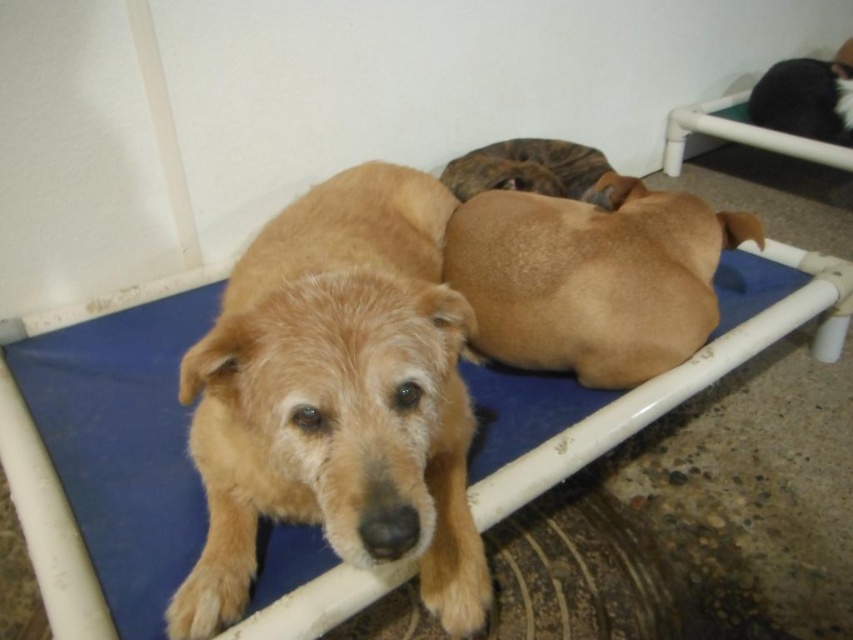
Can you confirm if brown matte dog at center is bigger than brown fur dog at center?

Correct, brown matte dog at center is larger in size than brown fur dog at center.

Is brown matte dog at center positioned at the back of brown fur dog at center?

That is False.

Identify the location of brown matte dog at center. Image resolution: width=853 pixels, height=640 pixels. (590, 276).

From the picture: Measure the distance between brown matte dog at center and black fur at upper right.

They are 1.52 meters apart.

Who is shorter, brown matte dog at center or black fur at upper right?

black fur at upper right is shorter.

Which is behind, point (672, 280) or point (840, 65)?

The point (840, 65) is more distant.

Locate an element on the screen. brown matte dog at center is located at coordinates (590, 276).

Is golden fur dog at center positioned in front of brown fur dog at center?

That is True.

Measure the distance between point (381, 172) and camera.

Point (381, 172) is 1.81 meters away from camera.

The width and height of the screenshot is (853, 640). What are the coordinates of `golden fur dog at center` in the screenshot? It's located at (337, 400).